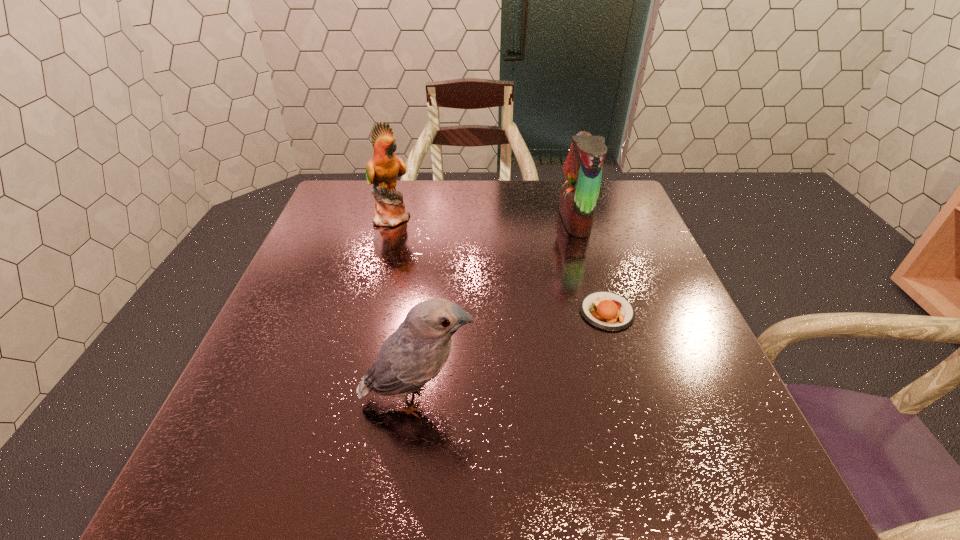
At what (x,y) coordinates should I click in order to perform the action: click on the rightmost parrot. Please return your answer as a coordinate pair (x, y). This screenshot has width=960, height=540. Looking at the image, I should click on (583, 168).

Where is `the nearest parrot`? This screenshot has height=540, width=960. the nearest parrot is located at coordinates (415, 353).

At what (x,y) coordinates should I click in order to perform the action: click on patty (food). Please return your answer as a coordinate pair (x, y). Looking at the image, I should click on (605, 310).

Where is `the shortest object`? The image size is (960, 540). the shortest object is located at coordinates (605, 310).

Identify the location of free space located 0.100m at the face of the rightmost parrot. This screenshot has height=540, width=960. (524, 220).

The height and width of the screenshot is (540, 960). Identify the location of free space located 0.360m at the face of the rightmost parrot. (432, 220).

Image resolution: width=960 pixels, height=540 pixels. What are the coordinates of `vacant position located 0.360m at the face of the rightmost parrot` in the screenshot? It's located at (432, 220).

I want to click on free location located on the front-facing side of the nearest parrot, so click(x=515, y=400).

Locate an element on the screen. The height and width of the screenshot is (540, 960). vacant space positioned on the back of the third farthest object is located at coordinates (591, 260).

You are a GUI agent. You are given a task and a screenshot of the screen. Output one action in this format:
    pyautogui.click(x=<x>, y=<y>)
    Task: Click on the object that is at the left edge
    
    Given the screenshot: What is the action you would take?
    pyautogui.click(x=382, y=170)